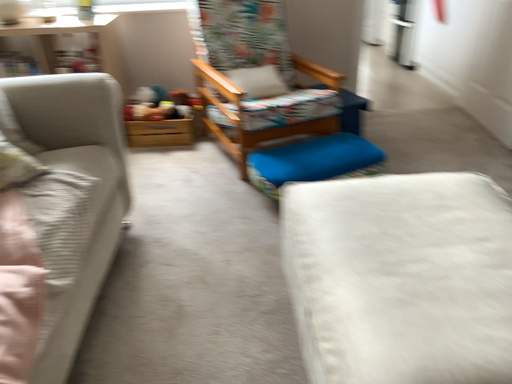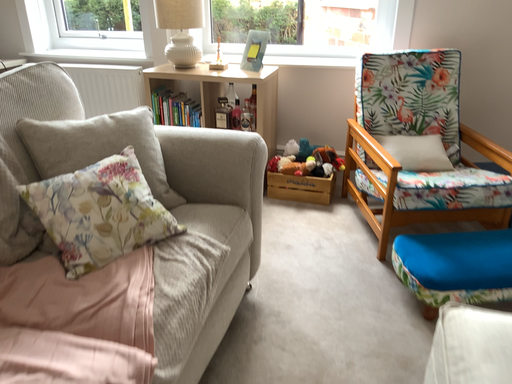
Question: How did the camera likely rotate when shooting the video?

Choices:
 (A) rotated left
 (B) rotated right

Answer: (A)